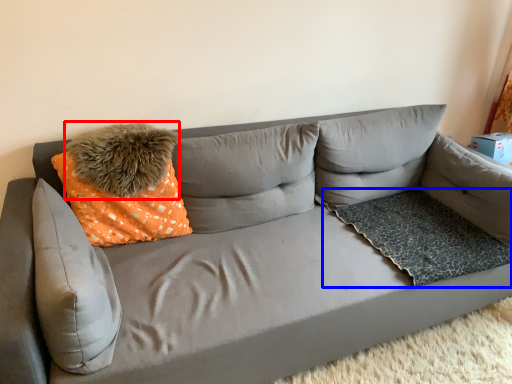
Question: Which object is closer to the camera taking this photo, pillow (highlighted by a red box) or dog bed (highlighted by a blue box)?

Choices:
 (A) pillow
 (B) dog bed

Answer: (A)